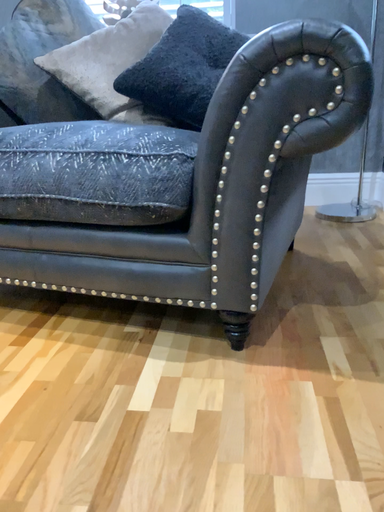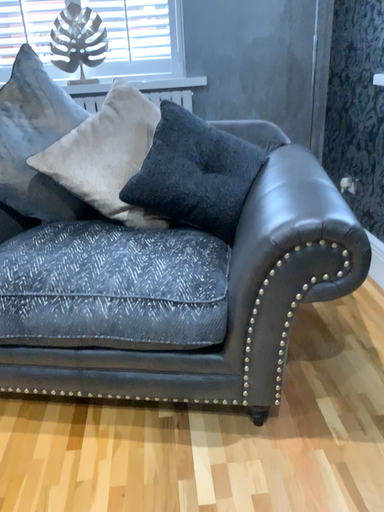
Question: How did the camera likely rotate when shooting the video?

Choices:
 (A) rotated right
 (B) rotated left

Answer: (A)